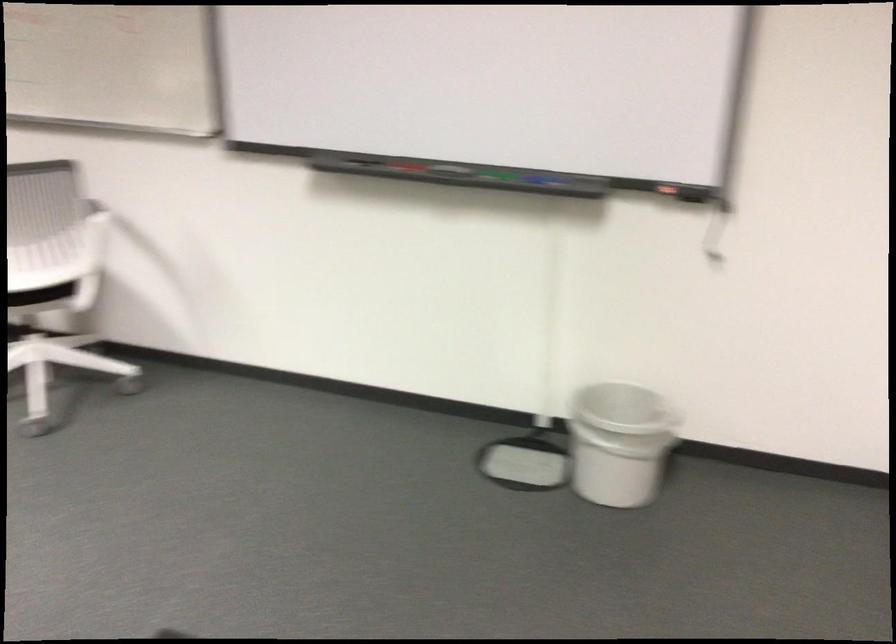
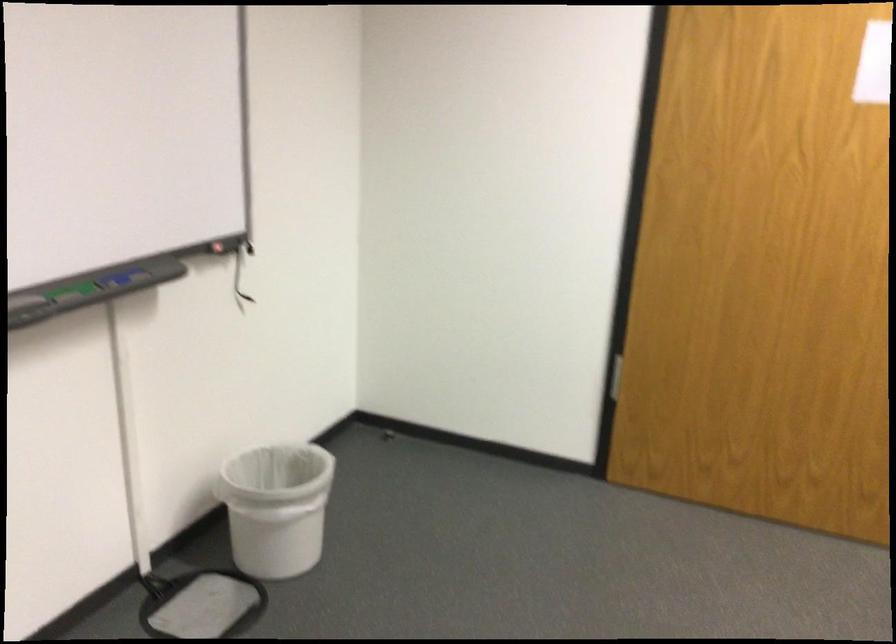
Locate, in the second image, the point that corresponds to (x=582, y=480) in the first image.

(277, 507)